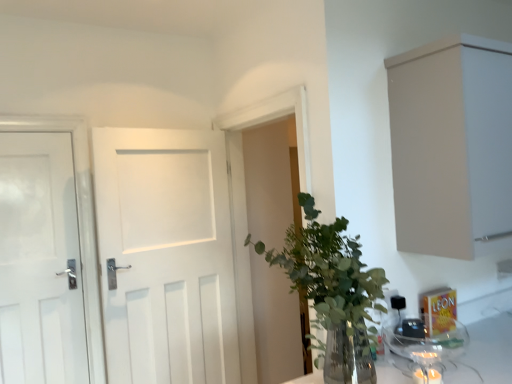
Question: Considering the relative sizes of transparent glass jar at lower right and green leafy plant at center in the image provided, is transparent glass jar at lower right shorter than green leafy plant at center?

Choices:
 (A) yes
 (B) no

Answer: (A)

Question: From the image's perspective, is transparent glass jar at lower right on green leafy plant at center?

Choices:
 (A) no
 (B) yes

Answer: (A)

Question: Is green leafy plant at center completely or partially inside transparent glass jar at lower right?

Choices:
 (A) yes
 (B) no

Answer: (B)

Question: From a real-world perspective, is transparent glass jar at lower right positioned under green leafy plant at center based on gravity?

Choices:
 (A) yes
 (B) no

Answer: (A)

Question: Is transparent glass jar at lower right positioned with its back to green leafy plant at center?

Choices:
 (A) yes
 (B) no

Answer: (A)

Question: From a real-world perspective, is white matte door at left, which ranks as the 2th door in right-to-left order, physically located above or below transparent glass jar at lower right?

Choices:
 (A) below
 (B) above

Answer: (B)

Question: Based on their sizes in the image, would you say white matte door at left, positioned as the first door in left-to-right order, is bigger or smaller than transparent glass jar at lower right?

Choices:
 (A) small
 (B) big

Answer: (B)

Question: From the image's perspective, relative to transparent glass jar at lower right, is white matte door at left, which ranks as the 2th door in right-to-left order, above or below?

Choices:
 (A) below
 (B) above

Answer: (B)

Question: Is point (60, 192) closer or farther from the camera than point (456, 322)?

Choices:
 (A) closer
 (B) farther

Answer: (B)

Question: Visually, is beige matte cabinet at upper right positioned to the left or to the right of white matte door at left, which ranks as the 2th door in right-to-left order?

Choices:
 (A) left
 (B) right

Answer: (B)

Question: Considering their positions, is beige matte cabinet at upper right located in front of or behind white matte door at left, which ranks as the 2th door in right-to-left order?

Choices:
 (A) front
 (B) behind

Answer: (A)

Question: Would you say beige matte cabinet at upper right is inside or outside white matte door at left, which ranks as the 2th door in right-to-left order?

Choices:
 (A) outside
 (B) inside

Answer: (A)

Question: From a real-world perspective, is beige matte cabinet at upper right positioned above or below white matte door at left, which ranks as the 2th door in right-to-left order?

Choices:
 (A) below
 (B) above

Answer: (B)

Question: Considering the positions of green leafy plant at center and beige matte cabinet at upper right in the image, is green leafy plant at center taller or shorter than beige matte cabinet at upper right?

Choices:
 (A) tall
 (B) short

Answer: (B)

Question: Is point (316, 367) closer or farther from the camera than point (489, 231)?

Choices:
 (A) closer
 (B) farther

Answer: (A)